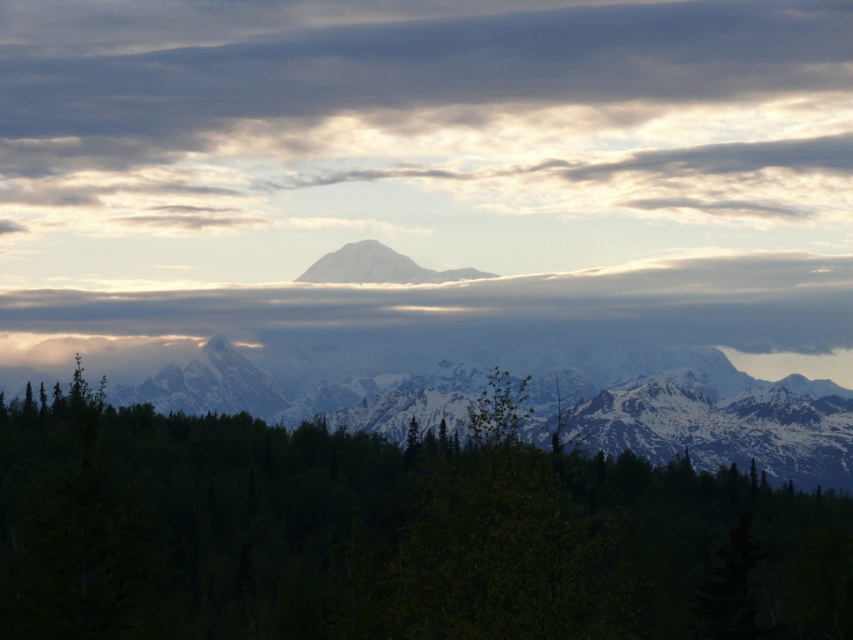
You are an airplane passenger looking out the window and see the cloudy sky at center and the snowy mountain range at center. Which one is closer to you?

The cloudy sky at center is closer to you because the snowy mountain range at center is behind it.

You are a hiker standing at the starting point of a trail. You want to reach the highest peak visible in the image. Which direction should you head from the green leafy forest at center?

The highest peak is located in the midground behind the green leafy forest at center, so you should head towards the mountains in the midground direction from the green leafy forest at center.

In the scene shown: You are an outdoor photographer planning to capture the sunset scene. You notice the cloudy sky at center and the snowy mountain range at center. Which object is positioned higher in the image?

The cloudy sky at center is located above the snowy mountain range at center, so it is positioned higher in the image.